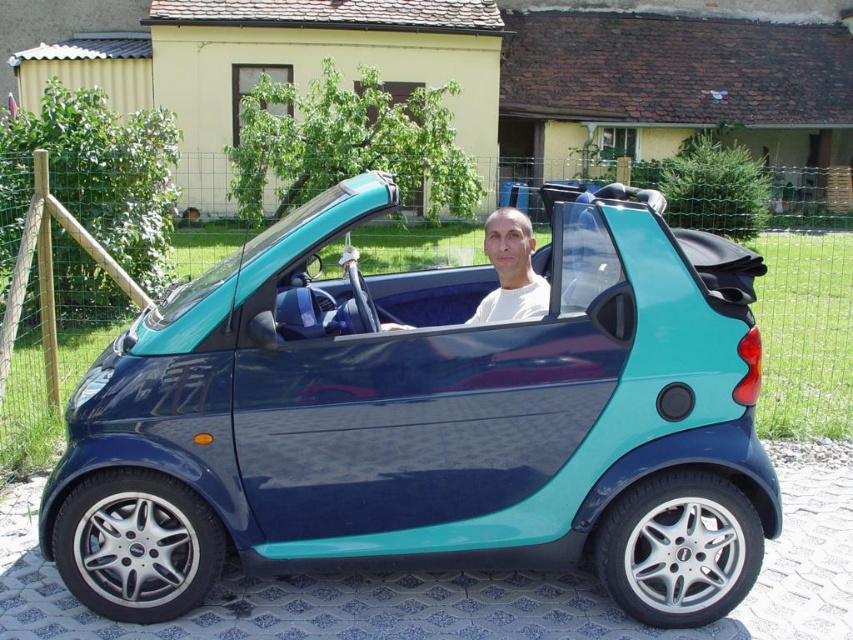
Who is taller, teal glossy car at center or white matte shirt at center?

teal glossy car at center

Is teal glossy car at center closer to the viewer compared to white matte shirt at center?

That is True.

Is point (361, 308) farther from camera compared to point (490, 257)?

No.

This screenshot has height=640, width=853. Identify the location of teal glossy car at center. (428, 417).